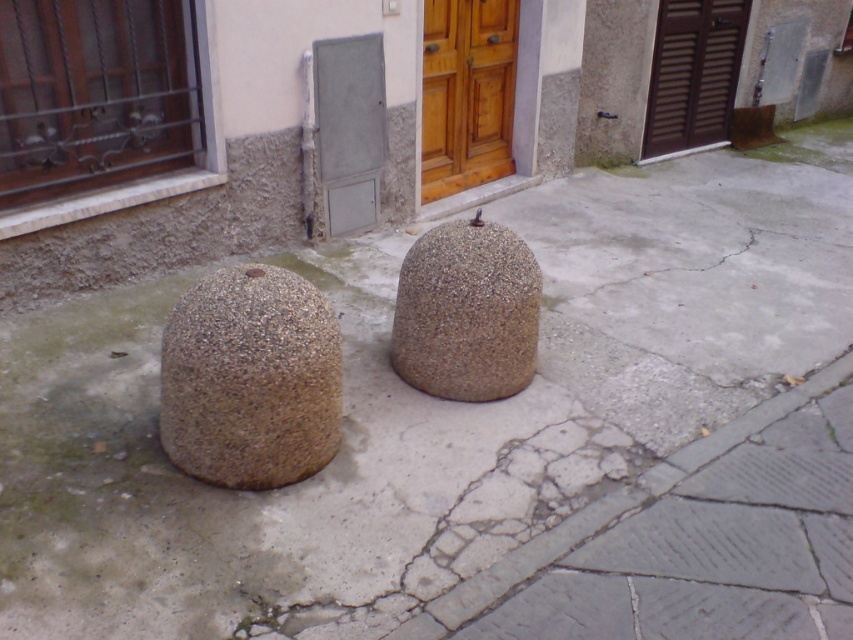
Which is behind, point (318, 376) or point (720, 35)?

The point (720, 35) is behind.

Is point (212, 310) closer to viewer compared to point (668, 152)?

Yes, it is.

This screenshot has height=640, width=853. Describe the element at coordinates (250, 380) in the screenshot. I see `granular stone boulder at lower left` at that location.

This screenshot has width=853, height=640. What are the coordinates of `granular stone boulder at lower left` in the screenshot? It's located at (250, 380).

Which is more to the right, granular stone boulder at lower left or granular stone boulder at center?

Positioned to the right is granular stone boulder at center.

Which is more to the left, granular stone boulder at lower left or granular stone boulder at center?

granular stone boulder at lower left

Is point (219, 328) positioned behind point (494, 252)?

No, (219, 328) is in front of (494, 252).

Image resolution: width=853 pixels, height=640 pixels. I want to click on granular stone boulder at lower left, so pyautogui.click(x=250, y=380).

Is point (167, 320) positioned in front of point (505, 129)?

That is True.

Can you confirm if granular stone boulder at lower left is positioned to the left of wooden at center?

Yes, granular stone boulder at lower left is to the left of wooden at center.

Is point (180, 465) closer to viewer compared to point (456, 74)?

Yes, it is in front of point (456, 74).

The width and height of the screenshot is (853, 640). Find the location of `granular stone boulder at lower left`. granular stone boulder at lower left is located at coordinates (250, 380).